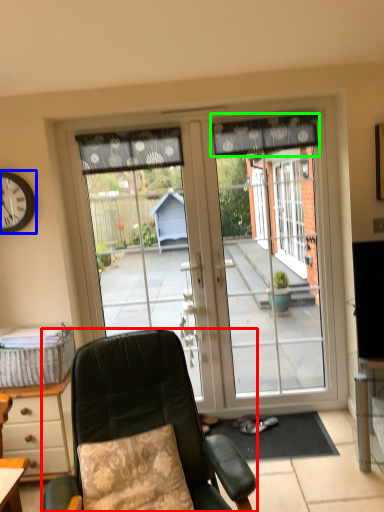
Question: Considering the real-world distances, which object is farthest from chair (highlighted by a red box)? clock (highlighted by a blue box) or curtain (highlighted by a green box)?

Choices:
 (A) clock
 (B) curtain

Answer: (B)